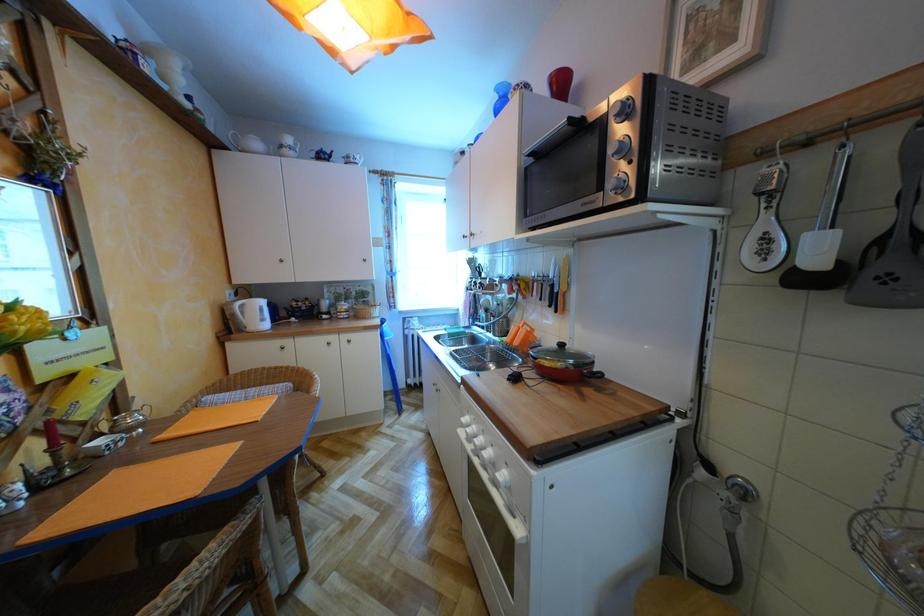
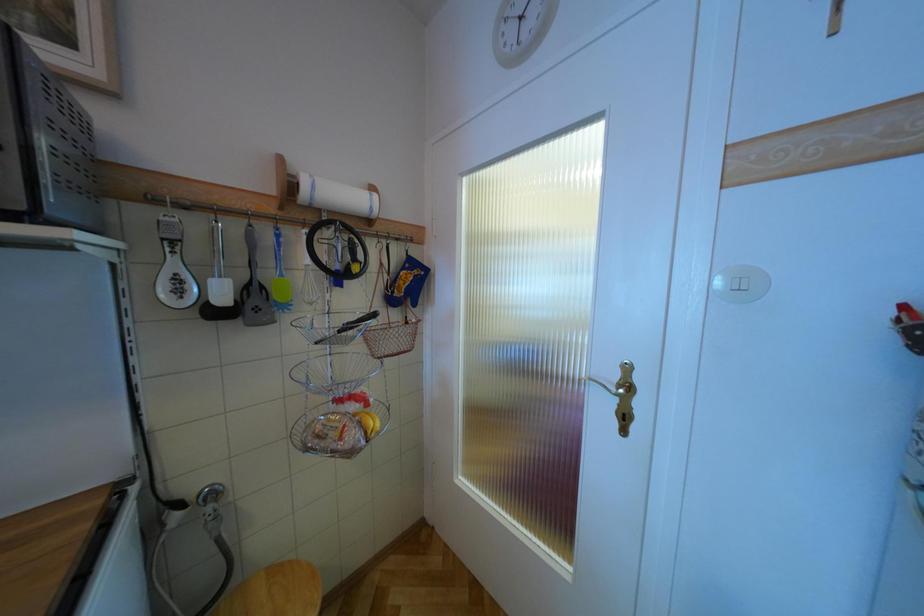
Question: The camera is either moving clockwise (left) or counter-clockwise (right) around the object. The first image is from the beginning of the video and the second image is from the end. Is the camera moving left or right when shooting the video?

Choices:
 (A) Left
 (B) Right

Answer: (A)